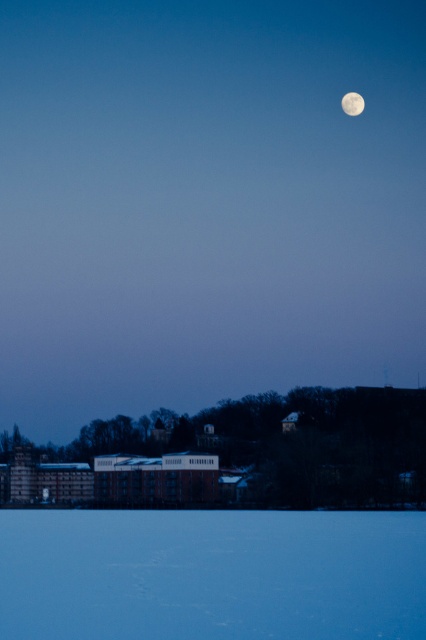
Question: Does white glossy moon at upper right have a greater width compared to white smooth moon at upper center?

Choices:
 (A) no
 (B) yes

Answer: (B)

Question: Which point is closer to the camera?

Choices:
 (A) (351, 115)
 (B) (236, 92)

Answer: (A)

Question: Is the position of white glossy moon at upper right less distant than that of white smooth moon at upper center?

Choices:
 (A) yes
 (B) no

Answer: (A)

Question: Is white glossy moon at upper right thinner than white smooth moon at upper center?

Choices:
 (A) yes
 (B) no

Answer: (B)

Question: Among these objects, which one is farthest from the camera?

Choices:
 (A) white smooth moon at upper center
 (B) white glossy moon at upper right

Answer: (A)

Question: Which object appears closest to the camera in this image?

Choices:
 (A) white smooth moon at upper center
 (B) white glossy moon at upper right

Answer: (B)